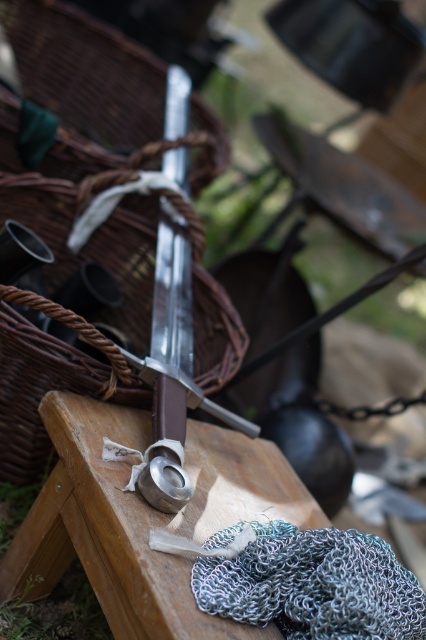
You are setting up a medieval display and need to place both the wooden table at center and the chainmail at center on a shelf. The shelf has a width of 1 meter. Can both items fit side by side without overlapping?

The wooden table at center might be wider than chainmail at center, but without knowing the exact width of the table, it is uncertain if both items can fit side by side on a 1 meter shelf. Measure the table first to confirm.

You are setting up a medieval display and need to place both the wooden table at center and the chainmail at center on the same wooden surface. Given their sizes, which object should you place first to ensure both fit properly?

The wooden table at center is larger in size than the chainmail at center, so you should place the wooden table at center first to ensure there is enough space left for the chainmail at center.